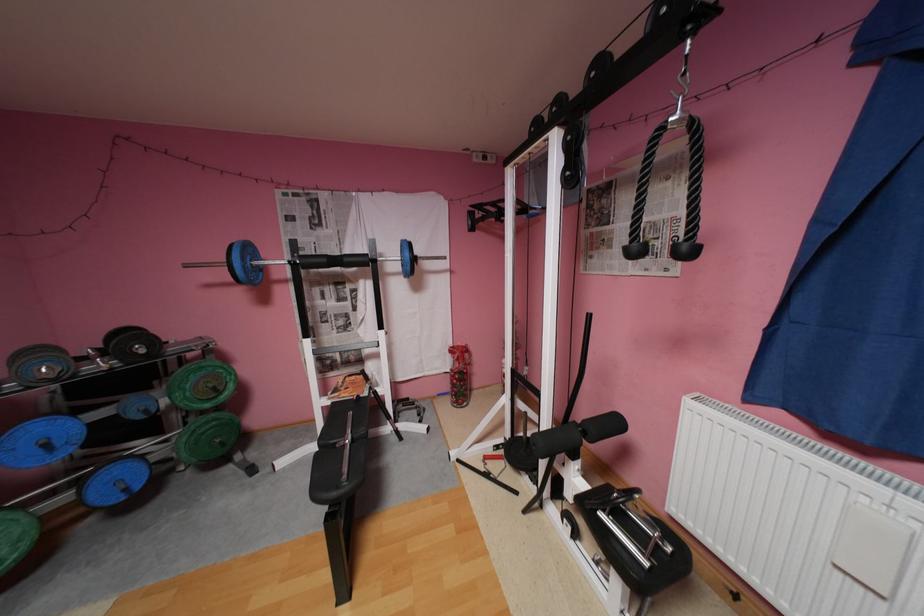
You are a GUI agent. You are given a task and a screenshot of the screen. Output one action in this format:
    pyautogui.click(x=<x>, y=<y>)
    Task: Click on the bench sitting surface
    
    Given the screenshot: What is the action you would take?
    pyautogui.click(x=339, y=483)